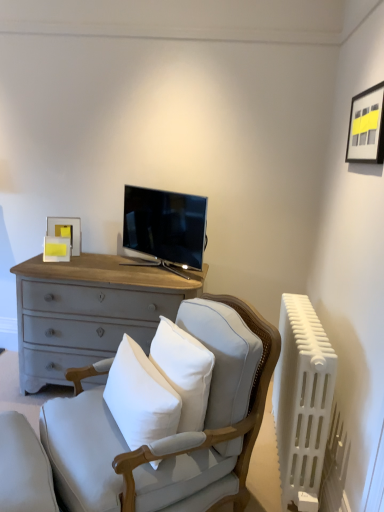
Question: Considering the positions of white cotton pillow at center and white plastic radiator at right in the image, is white cotton pillow at center wider or thinner than white plastic radiator at right?

Choices:
 (A) thin
 (B) wide

Answer: (B)

Question: Considering the positions of point (127, 389) and point (309, 315), is point (127, 389) closer or farther from the camera than point (309, 315)?

Choices:
 (A) farther
 (B) closer

Answer: (B)

Question: Which of these objects is positioned closest to the matte black tv at center?

Choices:
 (A) light gray fabric rocking chair at center
 (B) matte black picture frame at upper right, which is counted as the 1th picture frame, starting from the top
 (C) matte gray cushion at lower left
 (D) white cotton pillow at center
 (E) matte yellow picture frame at upper left, which is the second picture frame from right to left

Answer: (E)

Question: Based on their relative distances, which object is farther from the matte black tv at center?

Choices:
 (A) matte yellow picture frame at upper left, the 1th picture frame positioned from the bottom
 (B) white plastic radiator at right
 (C) light gray fabric rocking chair at center
 (D) white cotton pillow at center
 (E) matte gray cushion at lower left

Answer: (E)